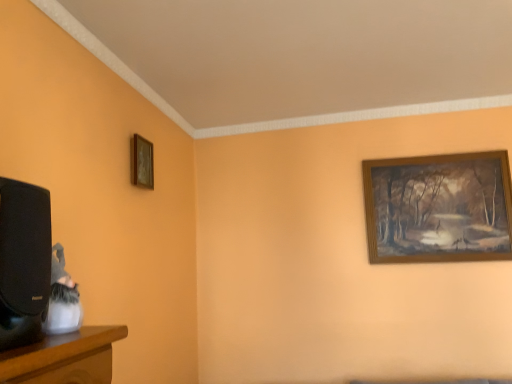
Question: Considering the positions of wooden picture frame at upper left, the first picture frame positioned from the front, and wooden picture frame at upper right, which appears as the 1th picture frame when viewed from the back, in the image, is wooden picture frame at upper left, the first picture frame positioned from the front, taller or shorter than wooden picture frame at upper right, which appears as the 1th picture frame when viewed from the back,?

Choices:
 (A) short
 (B) tall

Answer: (A)

Question: Considering the positions of point (138, 183) and point (505, 196), is point (138, 183) closer or farther from the camera than point (505, 196)?

Choices:
 (A) closer
 (B) farther

Answer: (A)

Question: Is wooden picture frame at upper left, which ranks as the second picture frame in back-to-front order, wider or thinner than wooden picture frame at upper right, which appears as the 1th picture frame when viewed from the back?

Choices:
 (A) thin
 (B) wide

Answer: (B)

Question: Is wooden picture frame at upper right, the second picture frame from the left, bigger or smaller than wooden picture frame at upper left, the second picture frame positioned from the right?

Choices:
 (A) small
 (B) big

Answer: (B)

Question: Is wooden picture frame at upper right, acting as the second picture frame starting from the front, in front of or behind wooden picture frame at upper left, which ranks as the second picture frame in back-to-front order, in the image?

Choices:
 (A) behind
 (B) front

Answer: (A)

Question: From the image's perspective, is wooden picture frame at upper right, arranged as the 1th picture frame when viewed from the right, located above or below wooden picture frame at upper left, the first picture frame positioned from the front?

Choices:
 (A) above
 (B) below

Answer: (B)

Question: Is wooden picture frame at upper right, arranged as the 1th picture frame when viewed from the right, wider or thinner than wooden picture frame at upper left, which ranks as the second picture frame in back-to-front order?

Choices:
 (A) thin
 (B) wide

Answer: (A)